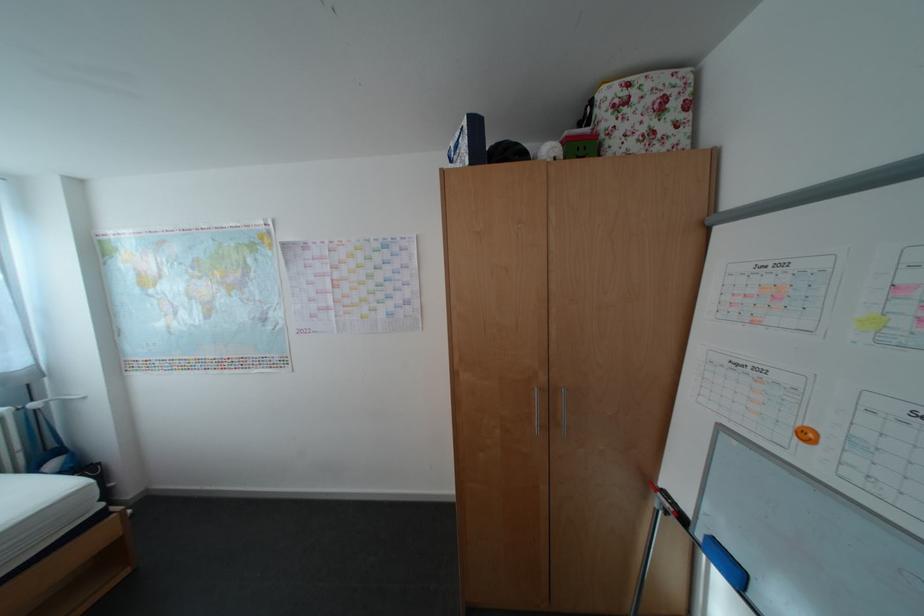
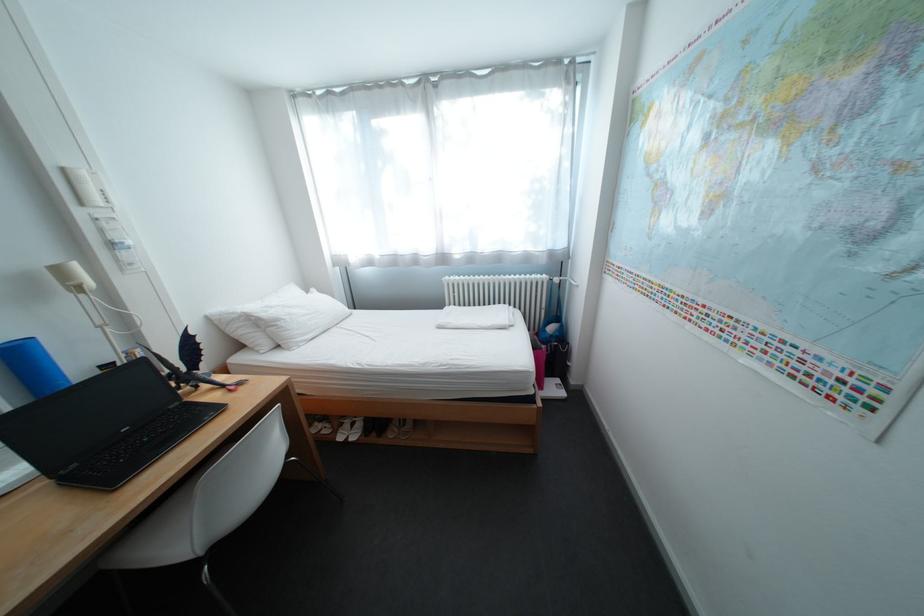
In the second image, find the point that corresponds to pixel 114 507 in the first image.

(544, 392)